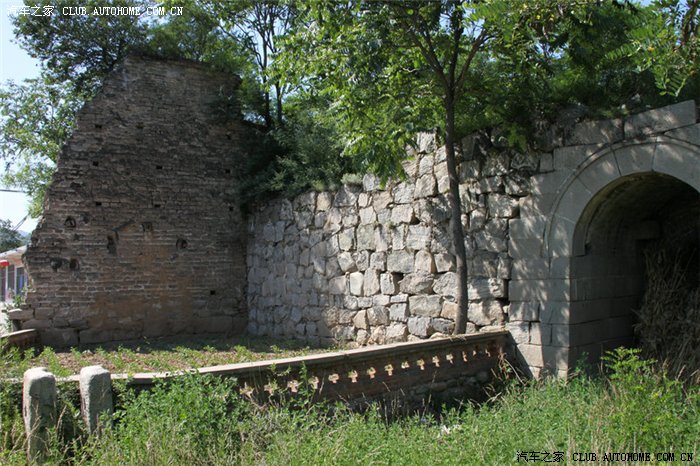
Locate an element on the screen. This screenshot has width=700, height=466. windows in house, left center side is located at coordinates (19, 276), (10, 285).